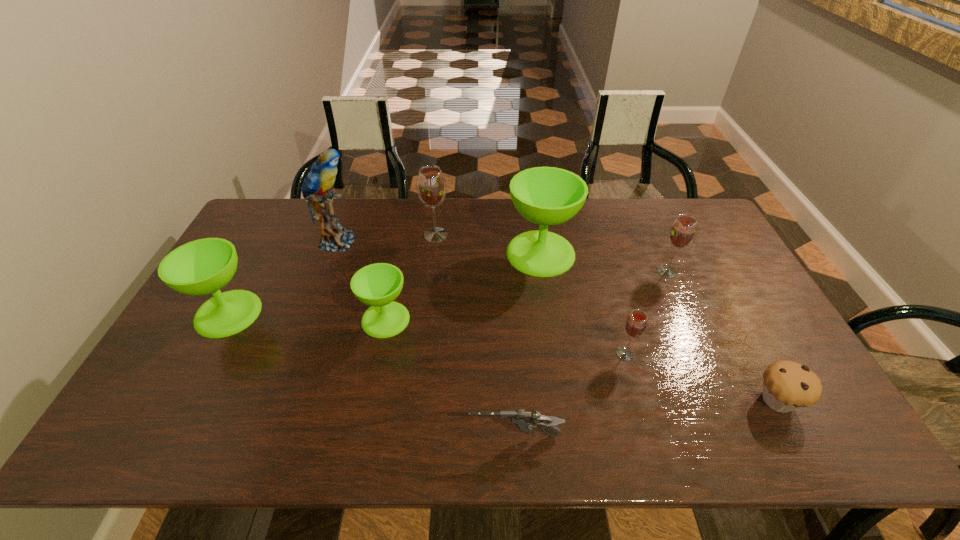
You are a GUI agent. You are given a task and a screenshot of the screen. Output one action in this format:
    pyautogui.click(x=<x>, y=<y>)
    Task: Click on the smallest red wineglass
    
    Given the screenshot: What is the action you would take?
    pyautogui.click(x=635, y=326)

Where is `the nearest red wineglass`? This screenshot has width=960, height=540. the nearest red wineglass is located at coordinates (635, 326).

You are a GUI agent. You are given a task and a screenshot of the screen. Output one action in this format:
    pyautogui.click(x=<x>, y=<y>)
    Task: Click on the second green wineglass from left to right
    
    Given the screenshot: What is the action you would take?
    pyautogui.click(x=377, y=285)

Where is `the eighth farthest object`? the eighth farthest object is located at coordinates (787, 386).

Identify the location of the rightmost object. (787, 386).

Locate an element on the screen. gun is located at coordinates (524, 421).

At what (x,y) coordinates should I click in order to perform the action: click on vacant space located on the face of the tallest object. Please return your answer as a coordinate pair (x, y). Image resolution: width=960 pixels, height=540 pixels. Looking at the image, I should click on (385, 241).

Locate an element on the screen. This screenshot has width=960, height=540. vacant space positioned on the back of the biggest green wineglass is located at coordinates (534, 205).

This screenshot has height=540, width=960. In order to click on vacant region located on the back of the farthest red wineglass in this screenshot , I will do `click(439, 206)`.

In order to click on vacant area situated 0.380m on the front of the eighth object from left to right in this screenshot , I will do `click(719, 387)`.